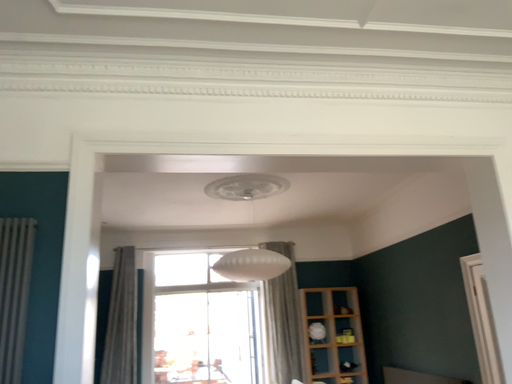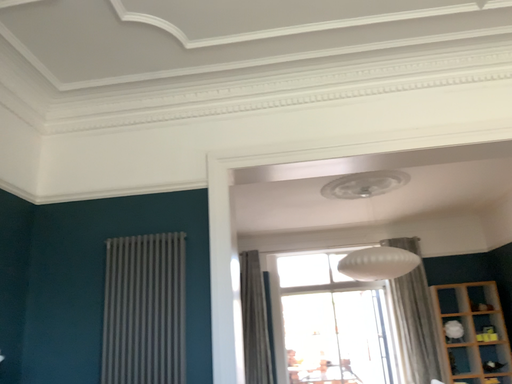
Question: How did the camera likely rotate when shooting the video?

Choices:
 (A) rotated left
 (B) rotated right

Answer: (A)